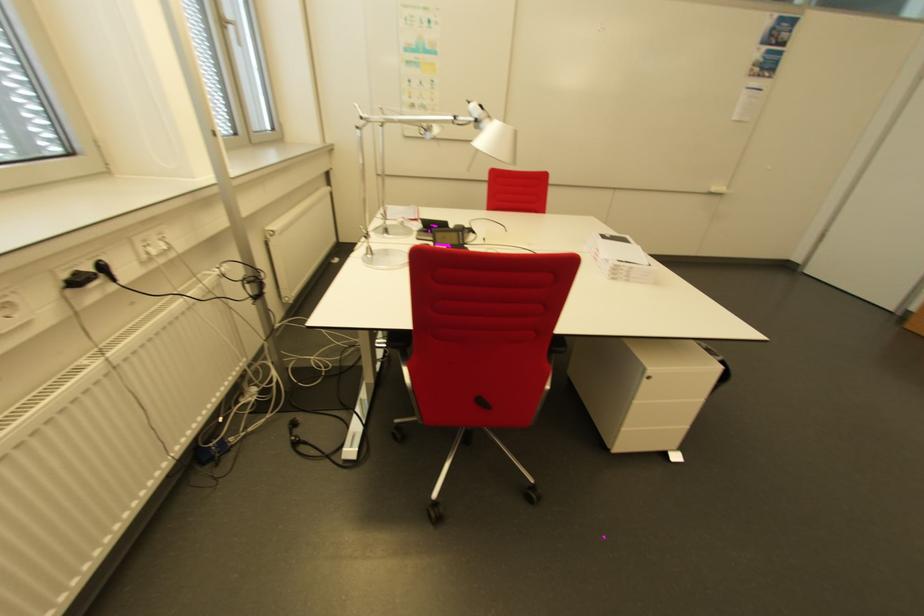
Identify the location of cabinet drawer handle. (648, 377).